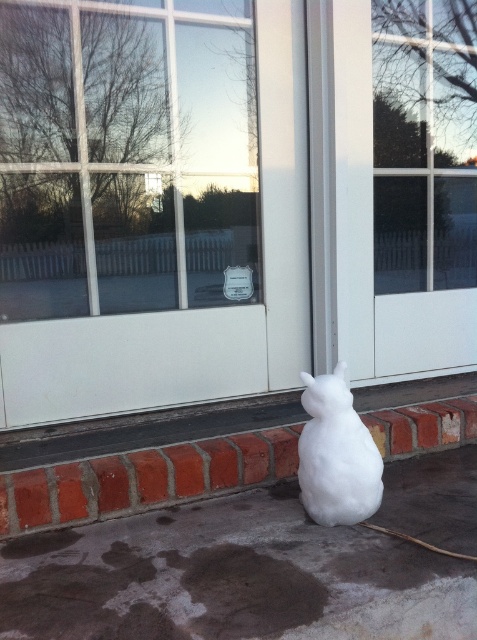
From the picture: You are a delivery person trying to place a package on the ground near the transparent glass door at center. However, there is already a white matte rabbit at lower center in the way. Can you move the rabbit to the side to make space?

The transparent glass door at center is bigger than white matte rabbit at lower center, so yes, you can move the white matte rabbit at lower center out of the way to create enough space for the package.

What is the position of the white matte screen door at upper right relative to the white matte rabbit at lower center?

The white matte screen door at upper right is positioned above the white matte rabbit at lower center.